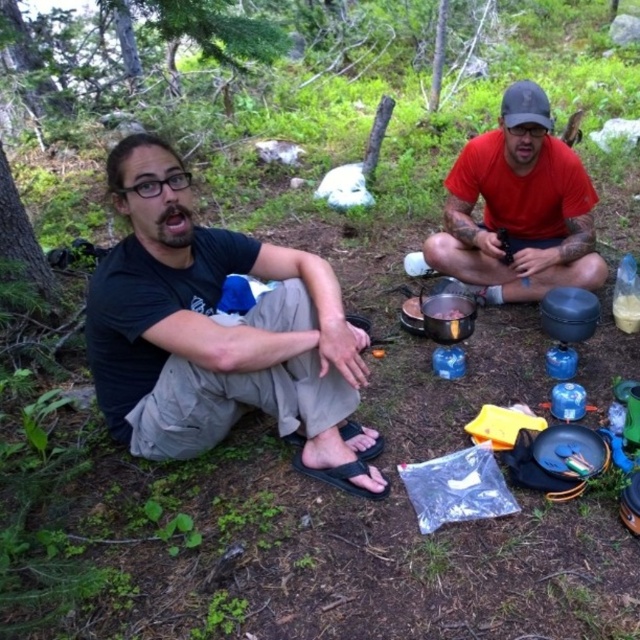
Question: Among these points, which one is farthest from the camera?

Choices:
 (A) (141, 257)
 (B) (499, 150)

Answer: (B)

Question: Does black matte shirt at left appear under red matte shirt at center?

Choices:
 (A) no
 (B) yes

Answer: (B)

Question: Is black matte shirt at left wider than red matte shirt at center?

Choices:
 (A) no
 (B) yes

Answer: (B)

Question: Which point is farther to the camera?

Choices:
 (A) black matte shirt at left
 (B) red matte shirt at center

Answer: (B)

Question: Does black matte shirt at left appear on the left side of red matte shirt at center?

Choices:
 (A) yes
 (B) no

Answer: (A)